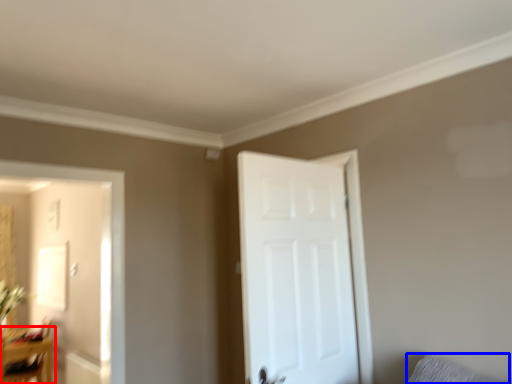
Question: Which of the following is the farthest to the observer, table (highlighted by a red box) or pillow (highlighted by a blue box)?

Choices:
 (A) table
 (B) pillow

Answer: (A)